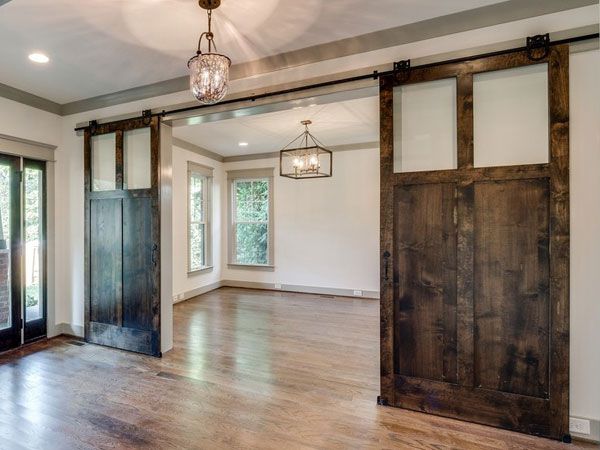
You are a GUI agent. You are given a task and a screenshot of the screen. Output one action in this format:
    pyautogui.click(x=<x>, y=<y>)
    Task: Click on the large wooden doors
    The image size is (600, 450).
    Given the screenshot: What is the action you would take?
    pyautogui.click(x=493, y=283), pyautogui.click(x=132, y=232)